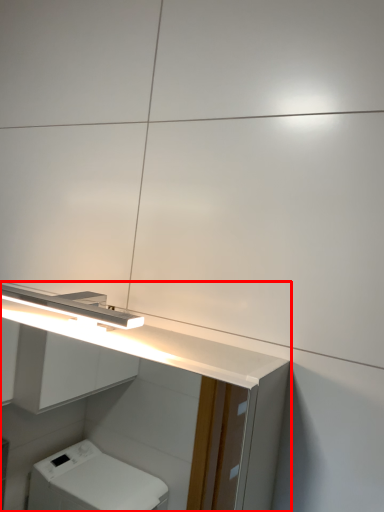
Question: In this image, where is bathroom cabinet (annotated by the red box) located relative to light fixture?

Choices:
 (A) right
 (B) left

Answer: (A)